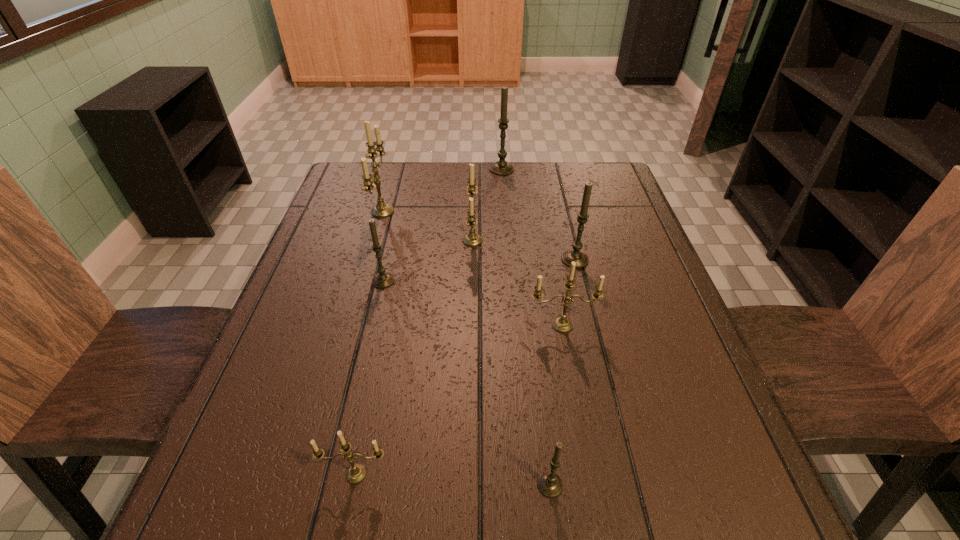
In order to click on vacant area between the smallest gray candle and the farthest gray candle in this screenshot , I will do `click(526, 327)`.

I want to click on unoccupied area between the smallest metallic candle and the second biggest metallic candle, so click(x=415, y=357).

The image size is (960, 540). Identify the location of free space between the fifth farthest candle and the third metallic candle from left to right. (428, 261).

You are a GUI agent. You are given a task and a screenshot of the screen. Output one action in this format:
    pyautogui.click(x=<x>, y=<y>)
    Task: Click on the free spot between the second smallest gray candle and the smallest gray candle
    This screenshot has height=540, width=960.
    Given the screenshot: What is the action you would take?
    pyautogui.click(x=467, y=382)

Identify the location of free spot between the second nearest metallic candle and the biggest metallic candle. This screenshot has width=960, height=540. (472, 268).

Where is `vacant space that's between the third farthest metallic candle and the smallest gray candle`? vacant space that's between the third farthest metallic candle and the smallest gray candle is located at coordinates (556, 405).

The image size is (960, 540). In order to click on unoccupied area between the third smallest metallic candle and the smallest metallic candle in this screenshot , I will do `click(415, 357)`.

Identify the location of free spot between the second biggest gray candle and the second biggest metallic candle. This screenshot has width=960, height=540. (524, 250).

I want to click on free point between the smallest gray candle and the fourth candle from left to right, so click(511, 362).

This screenshot has width=960, height=540. Identify the location of object that is the third closest to the second biggest gray candle. (501, 167).